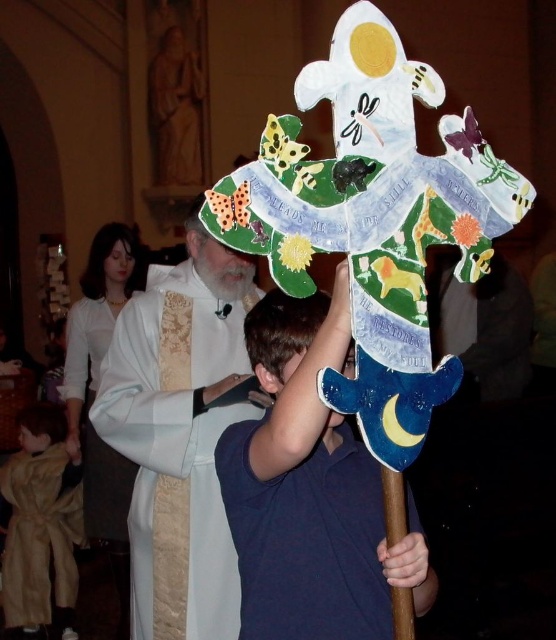
Between point (306, 358) and point (135, 470), which one is positioned behind?

The point (135, 470) is more distant.

Image resolution: width=556 pixels, height=640 pixels. What do you see at coordinates (310, 490) in the screenshot? I see `blue paper shield at center` at bounding box center [310, 490].

Image resolution: width=556 pixels, height=640 pixels. What are the coordinates of `blue paper shield at center` in the screenshot? It's located at (310, 490).

Does light brown plush robe at lower left have a lesser width compared to white silk robe at left?

No.

Does light brown plush robe at lower left have a smaller size compared to white silk robe at left?

Correct, light brown plush robe at lower left occupies less space than white silk robe at left.

Is point (26, 531) farther from camera compared to point (85, 481)?

No, (26, 531) is in front of (85, 481).

Locate an element on the screen. This screenshot has height=640, width=556. light brown plush robe at lower left is located at coordinates (42, 524).

Which is more to the left, white clothed figure at center or light brown plush robe at lower left?

light brown plush robe at lower left

Does point (163, 548) lie behind point (23, 611)?

No, (163, 548) is closer to viewer.

This screenshot has width=556, height=640. What do you see at coordinates (180, 435) in the screenshot?
I see `white clothed figure at center` at bounding box center [180, 435].

In order to click on white clothed figure at center in this screenshot , I will do `click(180, 435)`.